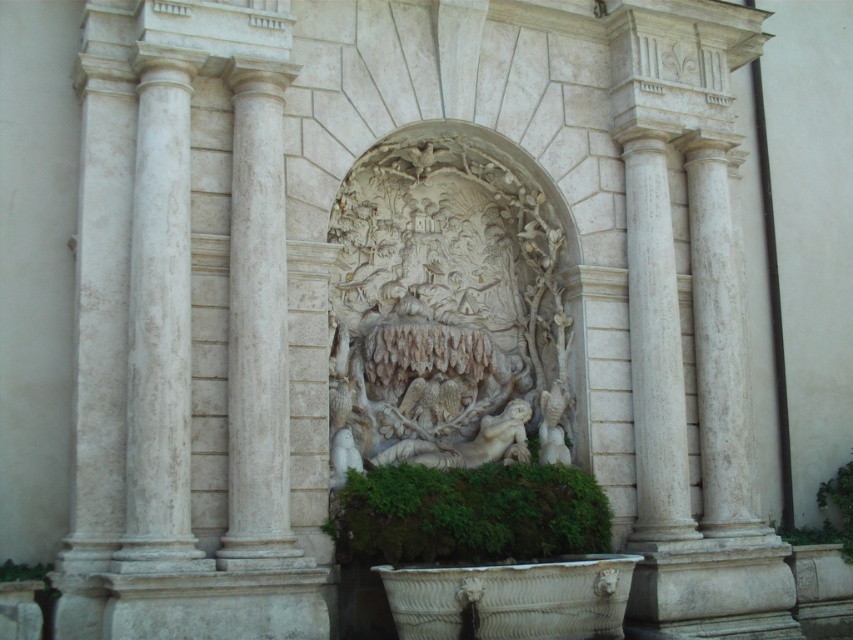
Question: Considering the real-world distances, which object is closest to the white marble column at right?

Choices:
 (A) white marble column at center
 (B) white marble column at left

Answer: (A)

Question: Considering the real-world distances, which object is closest to the white marble column at right?

Choices:
 (A) white marble column at center
 (B) white marble column at left
 (C) white stone carving at center

Answer: (C)

Question: Is white marble column at center bigger than white marble column at right?

Choices:
 (A) no
 (B) yes

Answer: (B)

Question: In this image, where is white marble column at left located relative to white marble column at center?

Choices:
 (A) right
 (B) left

Answer: (B)

Question: Does white marble column at left have a smaller size compared to white marble column at right?

Choices:
 (A) yes
 (B) no

Answer: (B)

Question: Which of the following is the farthest from the observer?

Choices:
 (A) white marble column at center
 (B) white stone carving at center
 (C) white marble column at right

Answer: (C)